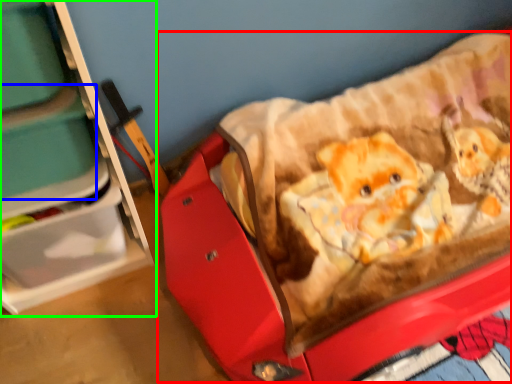
Question: Which is farther away from baby carriage (highlighted by a red box)? storage box (highlighted by a blue box) or furniture (highlighted by a green box)?

Choices:
 (A) storage box
 (B) furniture

Answer: (A)